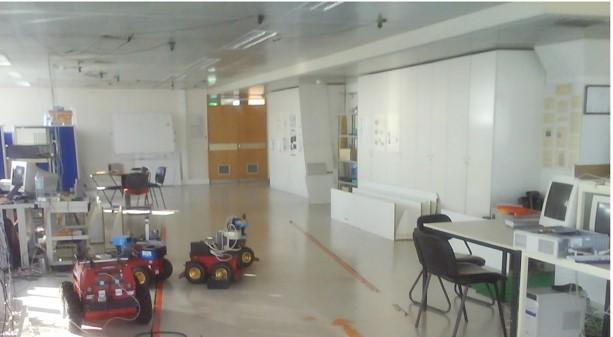
In order to click on computer monitor in this screenshot , I will do `click(558, 193)`, `click(582, 203)`, `click(602, 214)`, `click(13, 171)`.